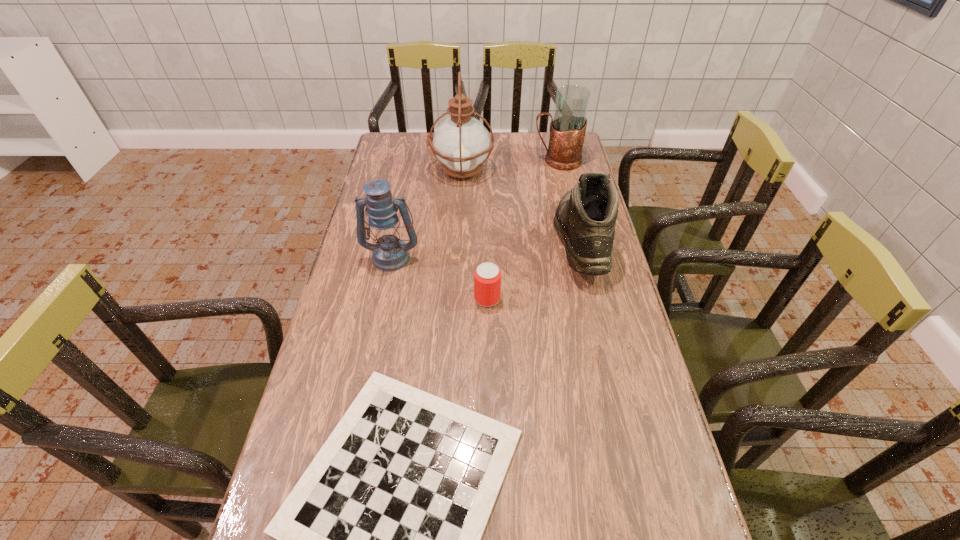
You are a GUI agent. You are given a task and a screenshot of the screen. Output one action in this format:
    pyautogui.click(x=<x>, y=<y>)
    Task: Click on the vacant space located on the left of the ski boot
    Image resolution: width=960 pixels, height=540 pixels.
    Given the screenshot: What is the action you would take?
    pyautogui.click(x=485, y=241)

In order to click on free region located 0.070m on the back of the second shortest object in this screenshot , I will do `click(487, 272)`.

I want to click on oil lamp that is at the far edge, so click(461, 143).

Identify the location of pitcher present at the far edge. This screenshot has height=540, width=960. (568, 126).

Where is `object present at the left edge`? Image resolution: width=960 pixels, height=540 pixels. object present at the left edge is located at coordinates (390, 253).

The image size is (960, 540). What are the coordinates of `pitcher located in the right edge section of the desktop` in the screenshot? It's located at point(568,126).

The width and height of the screenshot is (960, 540). Identify the location of ski boot present at the right edge. (585, 217).

Find the location of a particular element. The width and height of the screenshot is (960, 540). object that is at the far right corner is located at coordinates (568, 126).

The width and height of the screenshot is (960, 540). In the image, there is a desktop. In order to click on vacant space at the left edge in this screenshot , I will do `click(391, 190)`.

Where is `vacant space at the right edge`? vacant space at the right edge is located at coordinates (570, 275).